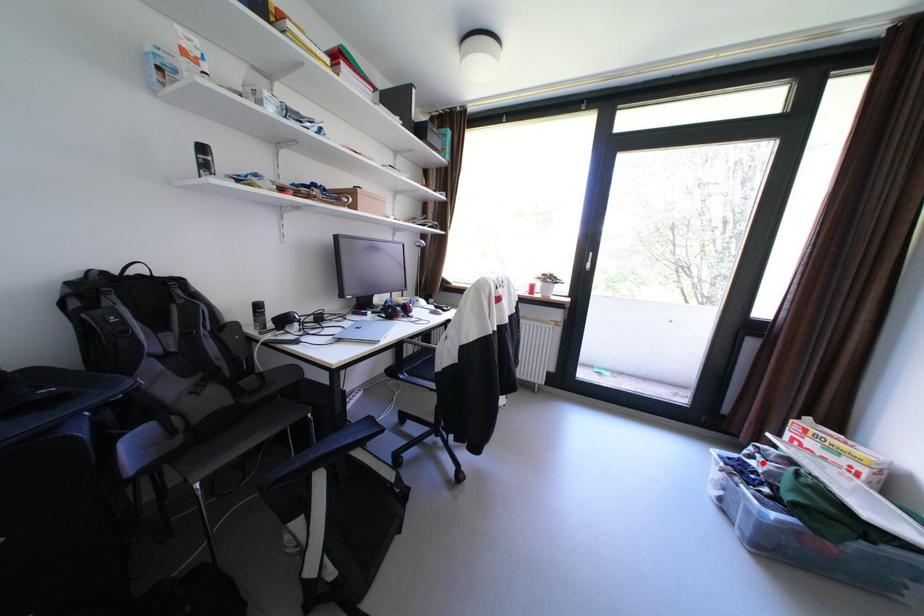
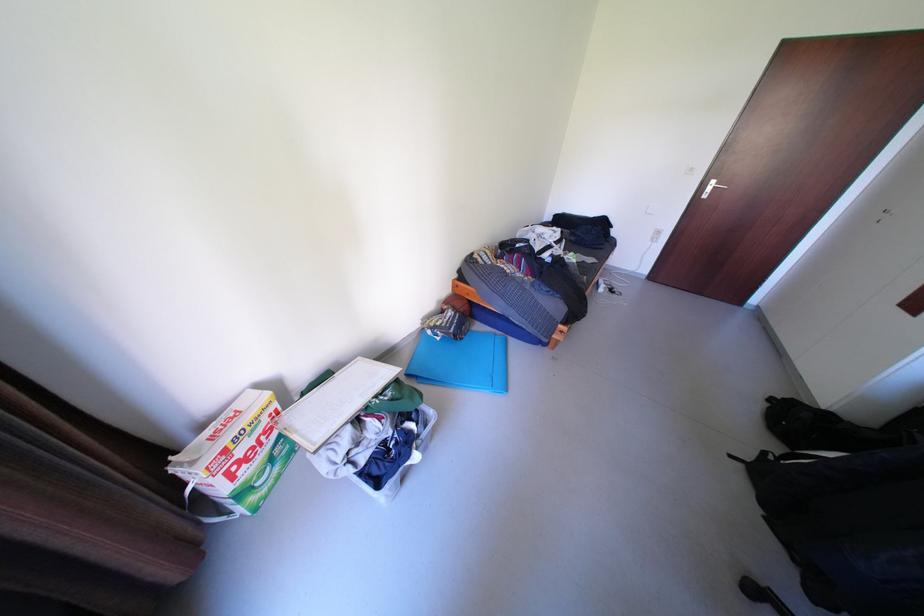
The point at the highlighted location is marked in the first image. Where is the corresponding point in the second image?

(372, 459)